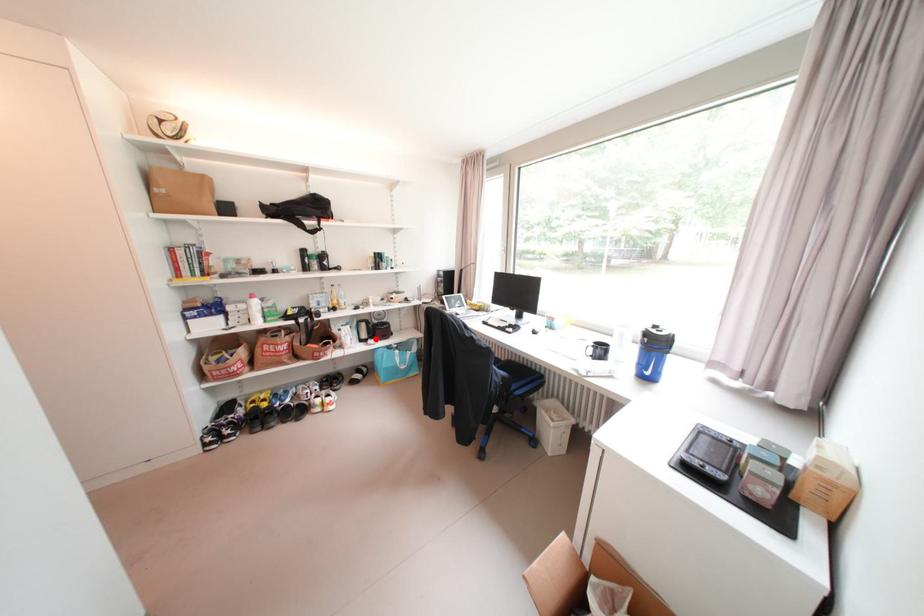
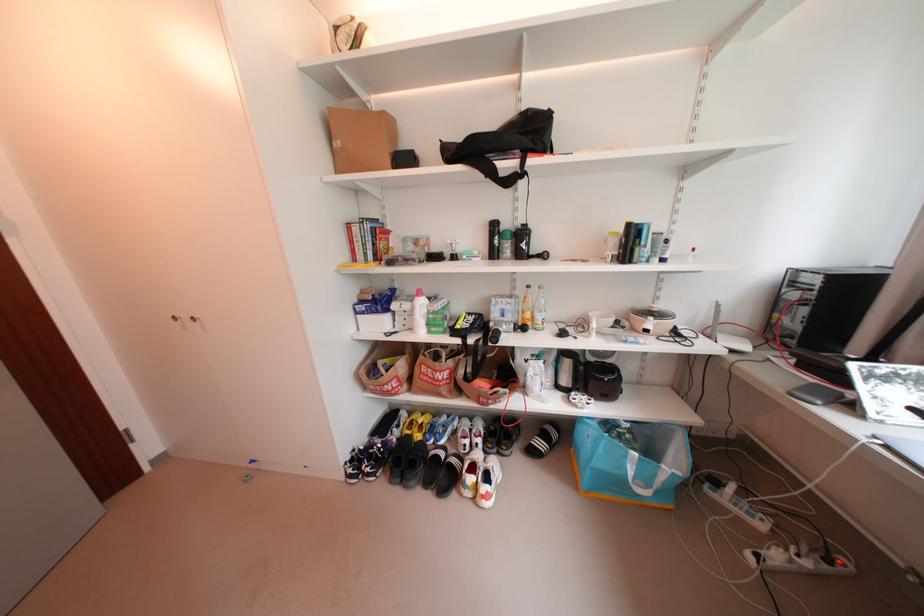
Locate, in the second image, the point that corresponds to the highlighted location in the first image.

(578, 387)